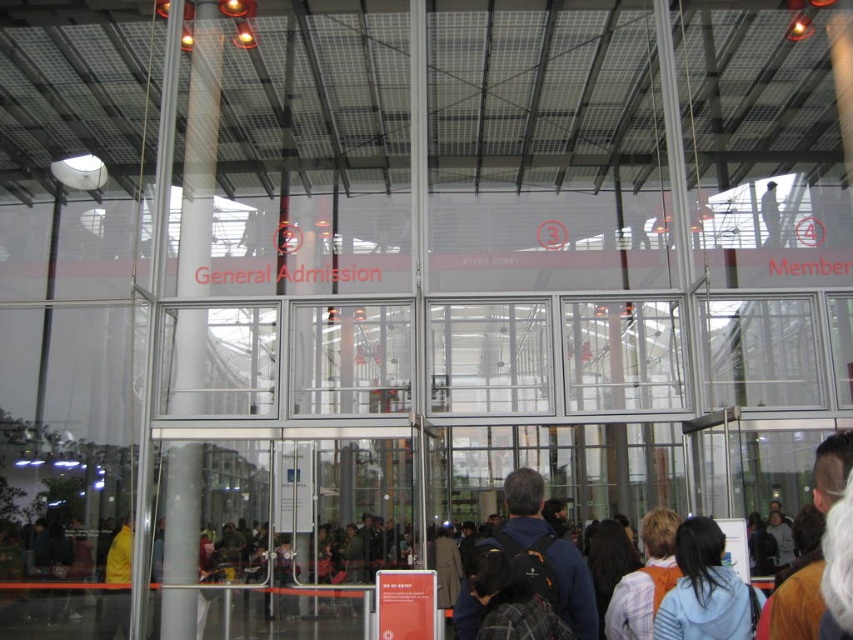
You are at the entrance of a large indoor venue and see a dark blue backpack at center and a light blue hoodie at lower right. Which item is located more to the left?

The dark blue backpack at center is more to the left than the light blue hoodie at lower right.